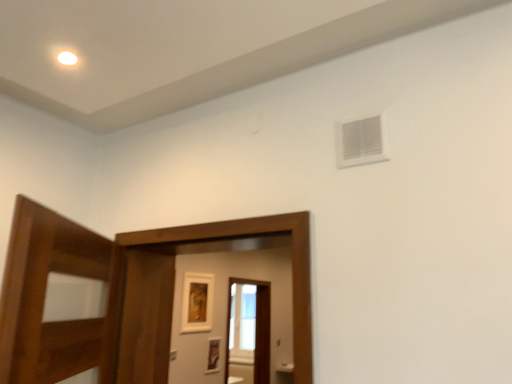
Question: Is the depth of transparent glass screen door at center, which is the 1th screen door from back to front, less than that of white plastic vent at upper right?

Choices:
 (A) no
 (B) yes

Answer: (A)

Question: Does transparent glass screen door at center, arranged as the 2th screen door when viewed from the front, have a larger size compared to white plastic vent at upper right?

Choices:
 (A) yes
 (B) no

Answer: (A)

Question: From a real-world perspective, is transparent glass screen door at center, which is the 1th screen door from back to front, located beneath white plastic vent at upper right?

Choices:
 (A) yes
 (B) no

Answer: (A)

Question: From the image's perspective, does transparent glass screen door at center, the first screen door when ordered from bottom to top, appear higher than white plastic vent at upper right?

Choices:
 (A) yes
 (B) no

Answer: (B)

Question: From the image's perspective, is transparent glass screen door at center, the second screen door from the top, located beneath white plastic vent at upper right?

Choices:
 (A) no
 (B) yes

Answer: (B)

Question: Based on their positions, is brown wooden screen door at center, the second screen door from the bottom, located to the left or right of white plastic vent at upper right?

Choices:
 (A) left
 (B) right

Answer: (A)

Question: From the image's perspective, is brown wooden screen door at center, acting as the first screen door starting from the front, located above or below white plastic vent at upper right?

Choices:
 (A) above
 (B) below

Answer: (B)

Question: Does point (130, 352) appear closer or farther from the camera than point (366, 160)?

Choices:
 (A) closer
 (B) farther

Answer: (B)

Question: Which is correct: brown wooden screen door at center, arranged as the second screen door when viewed from the back, is inside white plastic vent at upper right, or outside of it?

Choices:
 (A) outside
 (B) inside

Answer: (A)

Question: Considering the relative positions of brown wooden screen door at center, placed as the first screen door when sorted from top to bottom, and matte gold picture frame at center, the 1th picture frame from the top, in the image provided, is brown wooden screen door at center, placed as the first screen door when sorted from top to bottom, to the left or to the right of matte gold picture frame at center, the 1th picture frame from the top,?

Choices:
 (A) left
 (B) right

Answer: (B)

Question: From the image's perspective, relative to matte gold picture frame at center, the 1th picture frame from the top, is brown wooden screen door at center, arranged as the second screen door when viewed from the back, above or below?

Choices:
 (A) above
 (B) below

Answer: (A)

Question: From a real-world perspective, is brown wooden screen door at center, arranged as the second screen door when viewed from the back, physically located above or below matte gold picture frame at center, which is the second picture frame in bottom-to-top order?

Choices:
 (A) above
 (B) below

Answer: (B)

Question: Would you say brown wooden screen door at center, arranged as the second screen door when viewed from the back, is inside or outside matte gold picture frame at center, the 1th picture frame from the top?

Choices:
 (A) outside
 (B) inside

Answer: (A)

Question: Looking at their shapes, would you say transparent glass screen door at center, the second screen door from the top, is wider or thinner than white plastic vent at upper right?

Choices:
 (A) wide
 (B) thin

Answer: (A)

Question: Does point tap(259, 326) appear closer or farther from the camera than point tap(360, 122)?

Choices:
 (A) farther
 (B) closer

Answer: (A)